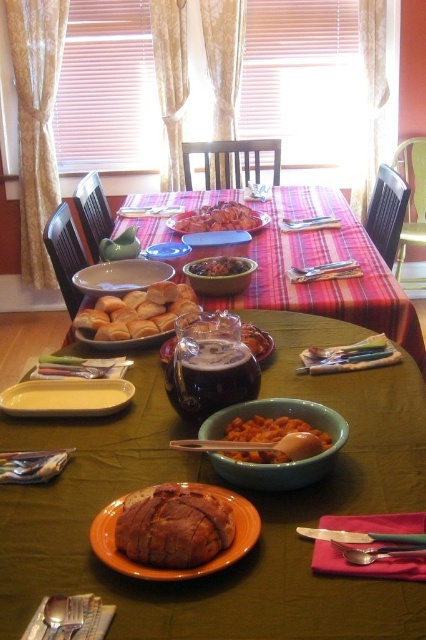
Question: Can you confirm if yellow matte plate at lower left is positioned to the right of matte blue plate at center?

Choices:
 (A) yes
 (B) no

Answer: (B)

Question: Is matte white plate at center smaller than matte glass bowl at center?

Choices:
 (A) no
 (B) yes

Answer: (A)

Question: Among these objects, which one is nearest to the camera?

Choices:
 (A) orange matte plate at center
 (B) pink plastic spoon at center
 (C) green matte bowl at center
 (D) yellow matte plate at lower left

Answer: (C)

Question: Which point is farther to the camera?

Choices:
 (A) pink plastic spoon at center
 (B) satin silver fork at lower left
 (C) matte blue plate at center

Answer: (C)

Question: Which object is positioned farthest from the satin silver knife at center?

Choices:
 (A) satin silver fork at lower left
 (B) dark glass beverage at center
 (C) pink fabric at lower right
 (D) orange matte plate at center

Answer: (A)

Question: Does slightly glossy brown bowl at center have a larger size compared to satin silver knife at center?

Choices:
 (A) no
 (B) yes

Answer: (B)